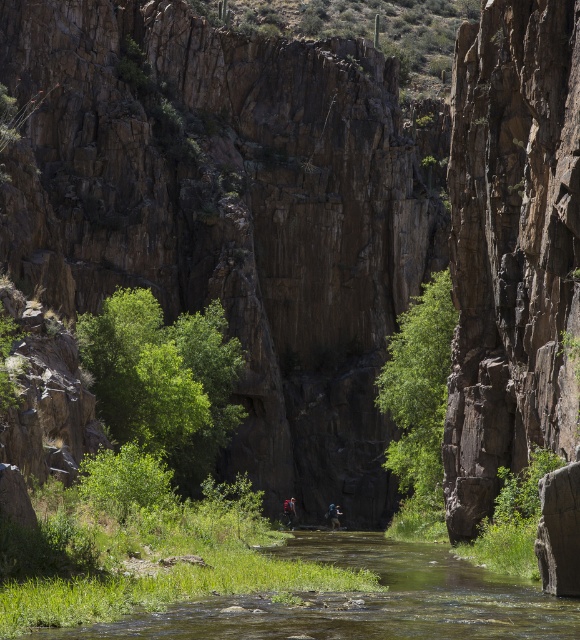
Question: Which point appears closest to the camera in this image?

Choices:
 (A) (284, 513)
 (B) (404, 544)
 (C) (335, 509)

Answer: (B)

Question: Which point is farther to the camera?

Choices:
 (A) (331, 512)
 (B) (288, 516)
 (C) (280, 554)

Answer: (A)

Question: Which object is farther from the camera taking this photo?

Choices:
 (A) green grassy stream at center
 (B) camouflage fabric backpack at center

Answer: (B)

Question: Is green grassy stream at center wider than camouflage fabric backpack at center?

Choices:
 (A) no
 (B) yes

Answer: (B)

Question: Is green grassy stream at center to the right of camouflage fabric backpack at center from the viewer's perspective?

Choices:
 (A) yes
 (B) no

Answer: (A)

Question: From the image, what is the correct spatial relationship of green grassy stream at center in relation to blue fabric backpack at center?

Choices:
 (A) below
 (B) above

Answer: (B)